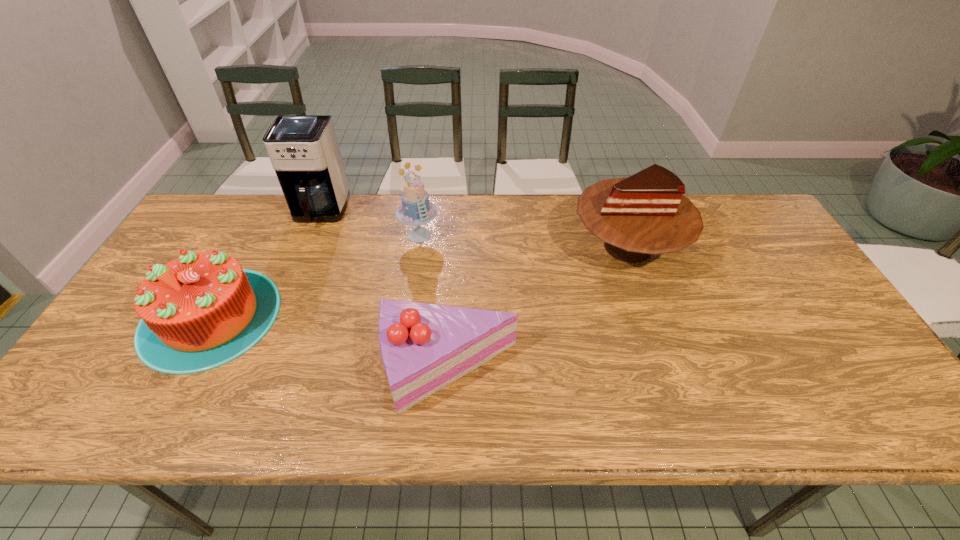
This screenshot has height=540, width=960. I want to click on vacant region between the tallest object and the leftmost cake, so click(265, 264).

I want to click on the third closest object relative to the leftmost cake, so click(424, 347).

Select which object appears as the third closest to the shortest cake. Please provide its 2D coordinates. Your answer should be formatted as a tuple, i.e. [(x, y)], where the tuple contains the x and y coordinates of a point satisfying the conditions above.

[(415, 209)]

Locate which cake is the second closest to the leftmost cake. Please provide its 2D coordinates. Your answer should be formatted as a tuple, i.e. [(x, y)], where the tuple contains the x and y coordinates of a point satisfying the conditions above.

[(424, 347)]

This screenshot has height=540, width=960. Find the location of `cake that stands as the fourth closest to the tallest object`. cake that stands as the fourth closest to the tallest object is located at coordinates (646, 214).

This screenshot has height=540, width=960. In order to click on vacant space that satisfies the following two spatial constraints: 1. on the front panel of the coffee maker; 2. on the left side of the shortest cake in this screenshot , I will do `click(256, 369)`.

The image size is (960, 540). I want to click on free space that satisfies the following two spatial constraints: 1. on the front side of the leftmost cake; 2. on the right side of the shortest cake, so click(182, 369).